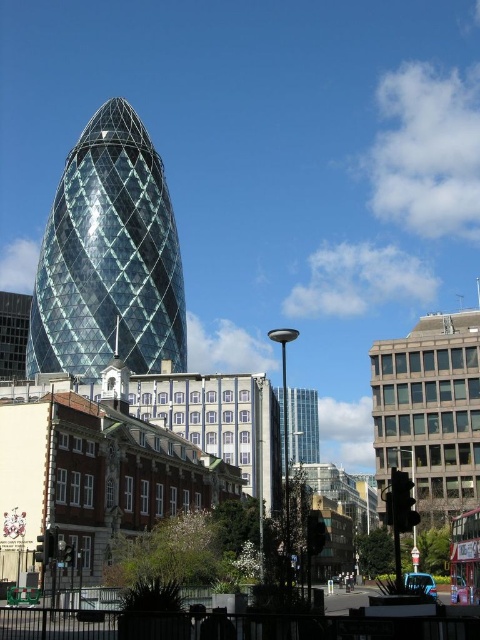
Does transparent glass tower at center have a greater height compared to glassy metallic skyscraper at center?

Indeed, transparent glass tower at center has a greater height compared to glassy metallic skyscraper at center.

Which is more to the right, transparent glass tower at center or glassy metallic skyscraper at center?

glassy metallic skyscraper at center is more to the right.

Between point (41, 307) and point (288, 428), which one is positioned in front?

Point (41, 307) is more forward.

Where is `transparent glass tower at center`? transparent glass tower at center is located at coordinates (108, 257).